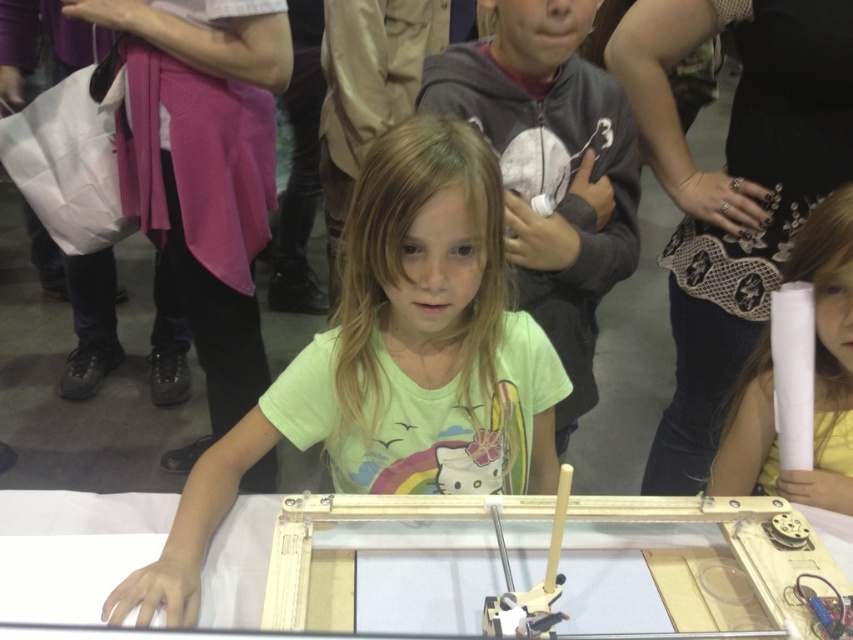
Is light green t-shirt at center smaller than smooth white paper at right?

Actually, light green t-shirt at center might be larger than smooth white paper at right.

Can you confirm if light green t-shirt at center is shorter than smooth white paper at right?

Incorrect, light green t-shirt at center's height does not fall short of smooth white paper at right's.

Is point (518, 374) positioned in front of point (802, 269)?

Yes, it is.

The width and height of the screenshot is (853, 640). What are the coordinates of `light green t-shirt at center` in the screenshot? It's located at (392, 358).